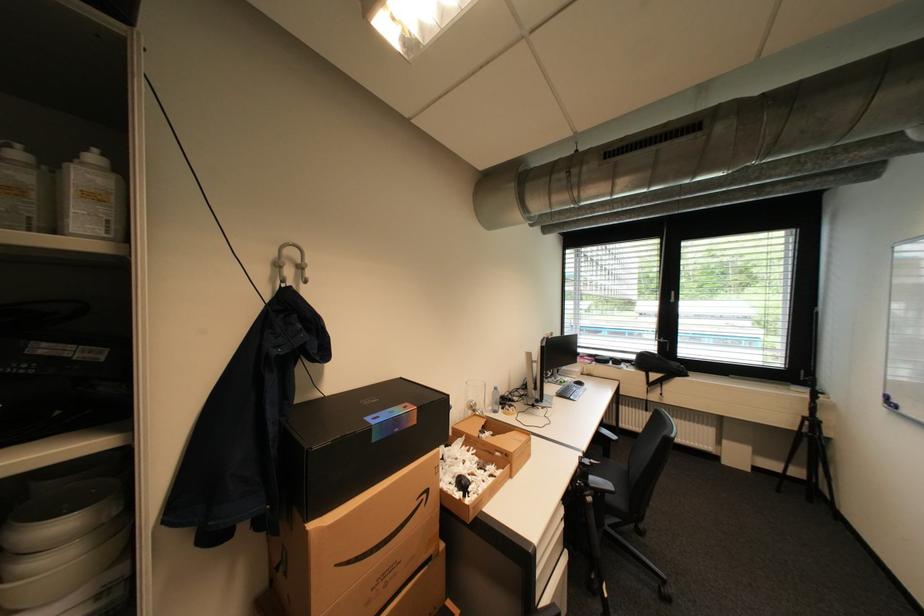
Find the location of `black tripod`. black tripod is located at coordinates (810, 453).